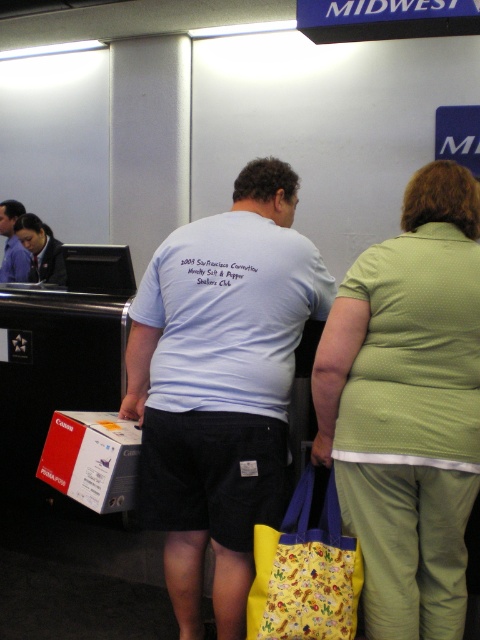
You are a security guard in the Midwest airport. You see a person wearing a matte black uniform at left and a blue cotton shirt at center. Which one is closer to you?

The matte black uniform at left is closer to you because it is in front of the blue cotton shirt at center.

You are an airport security officer inspecting two travelers. The first traveler is wearing a matte black uniform at left, and the second is wearing a blue cotton shirt at center. Which traveler is wearing a larger garment?

The matte black uniform at left is bigger than the blue cotton shirt at center, so the first traveler is wearing a larger garment.